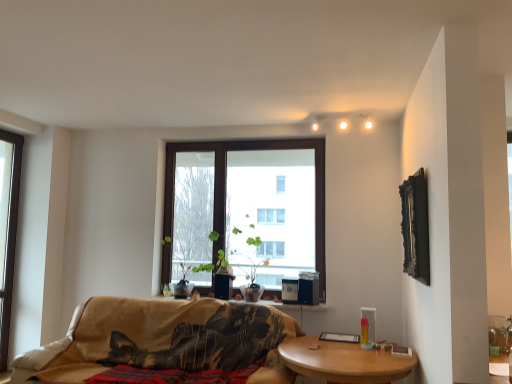
Locate an element on the screen. This screenshot has height=384, width=512. vacant space situated above wooden at lower right (from a real-world perspective) is located at coordinates (348, 350).